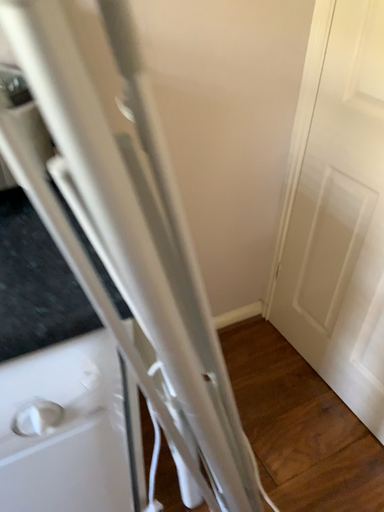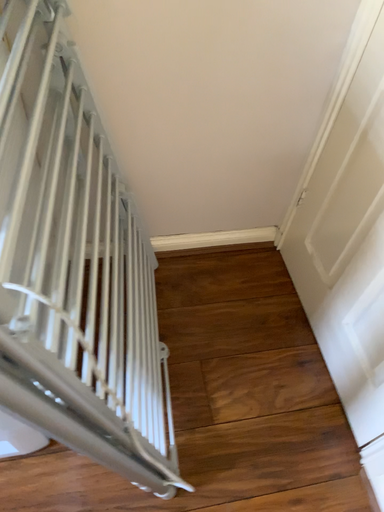
Question: Which way did the camera rotate in the video?

Choices:
 (A) rotated downward
 (B) rotated upward

Answer: (A)